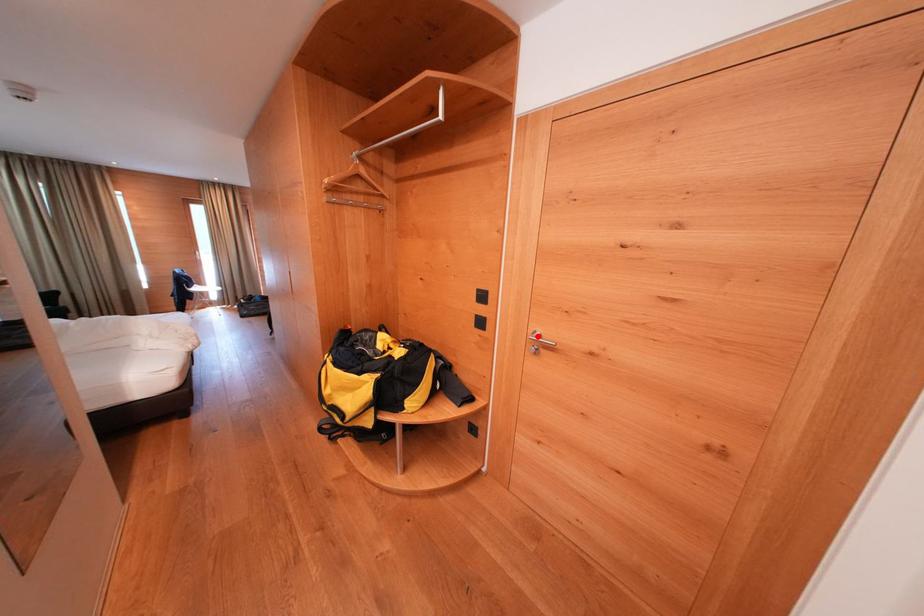
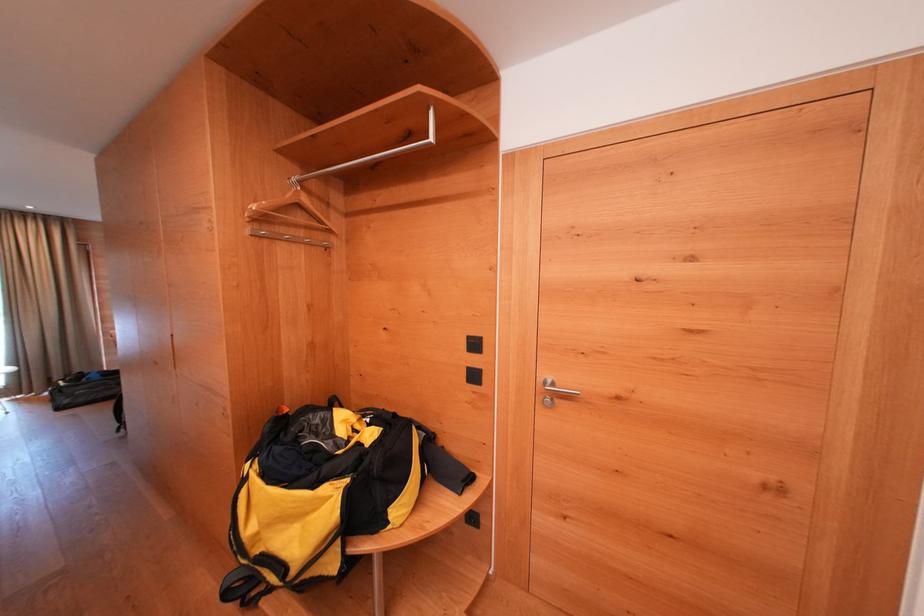
Where in the second image is the point corresponding to the highlighted location from the first image?

(546, 385)